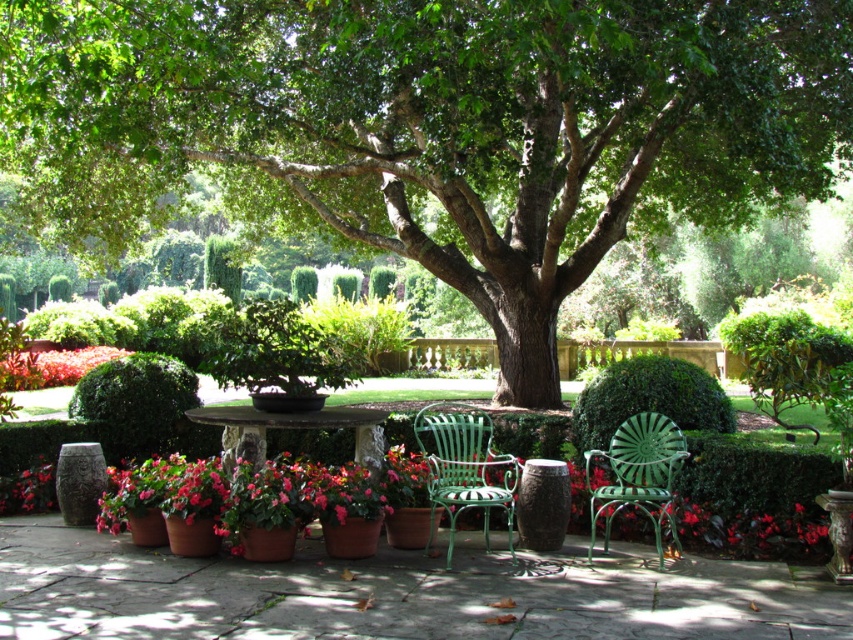
Which of these two, green textured hedge at center or vivid red petals at lower left, stands shorter?

green textured hedge at center

Is point (686, 403) positioned after point (74, 358)?

No, it is not.

Image resolution: width=853 pixels, height=640 pixels. In order to click on green textured hedge at center in this screenshot , I will do `click(648, 397)`.

Is point (612, 493) farther from camera compared to point (28, 513)?

No, it is not.

This screenshot has width=853, height=640. I want to click on green metal chair at center, so click(637, 474).

Between green leafy tree at center and stone table at center, which one appears on the right side from the viewer's perspective?

From the viewer's perspective, green leafy tree at center appears more on the right side.

Is green leafy tree at center to the right of stone table at center from the viewer's perspective?

Yes, green leafy tree at center is to the right of stone table at center.

The height and width of the screenshot is (640, 853). What do you see at coordinates (433, 125) in the screenshot?
I see `green leafy tree at center` at bounding box center [433, 125].

At what (x,y) coordinates should I click in order to perform the action: click on green leafy tree at center. Please return your answer as a coordinate pair (x, y). Looking at the image, I should click on (433, 125).